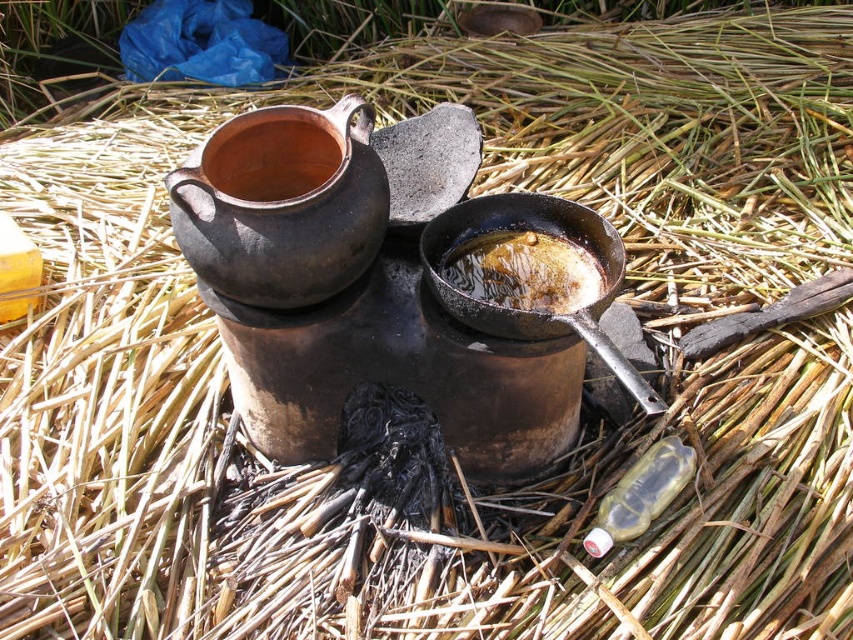
Looking at this image, is brown matte oil at center bigger than matte clay pot at center?

No.

Based on the photo, does brown matte oil at center have a greater width compared to matte clay pot at center?

Yes.

Is point (582, 262) positioned in front of point (204, 156)?

No.

Identify the location of brown matte oil at center. The height and width of the screenshot is (640, 853). (525, 272).

Between matte clay teapot at upper left and brown matte oil at center, which one has more height?

matte clay teapot at upper left is taller.

Does matte clay teapot at upper left come in front of brown matte oil at center?

Yes, it is in front of brown matte oil at center.

Find the location of a particular element. The image size is (853, 640). matte clay teapot at upper left is located at coordinates (282, 204).

Where is `matte clay teapot at upper left`? The width and height of the screenshot is (853, 640). matte clay teapot at upper left is located at coordinates (282, 204).

Who is lower down, matte clay teapot at upper left or matte clay pot at center?

Positioned lower is matte clay teapot at upper left.

Does matte clay teapot at upper left have a greater height compared to matte clay pot at center?

Yes, matte clay teapot at upper left is taller than matte clay pot at center.

Which is in front, point (235, 269) or point (318, 157)?

Point (235, 269) is in front.

Find the location of a particular element. matte clay teapot at upper left is located at coordinates (282, 204).